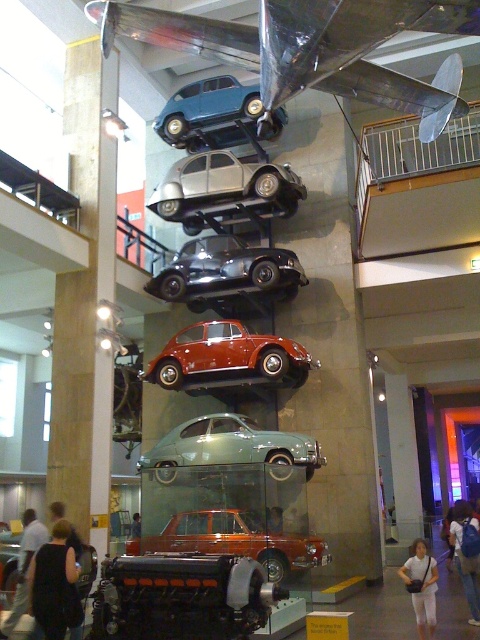
Question: Which point appears farthest from the camera in this image?

Choices:
 (A) (193, 212)
 (B) (283, 355)

Answer: (A)

Question: Can you confirm if shiny orange car at center is positioned below smooth brown leather jacket at center?

Choices:
 (A) no
 (B) yes

Answer: (B)

Question: Is shiny red car at center in front of shiny orange car at center?

Choices:
 (A) no
 (B) yes

Answer: (A)

Question: Does matte blue car at upper center appear under light brown leather jacket at lower center?

Choices:
 (A) no
 (B) yes

Answer: (A)

Question: Which point appears closest to the camera in this image?

Choices:
 (A) (249, 632)
 (B) (249, 420)
 (C) (423, 616)
 (D) (134, 520)

Answer: (A)

Question: Which object appears farthest from the camera in this image?

Choices:
 (A) smooth brown leather jacket at center
 (B) silver metallic car at center
 (C) denim jacket at lower right

Answer: (B)